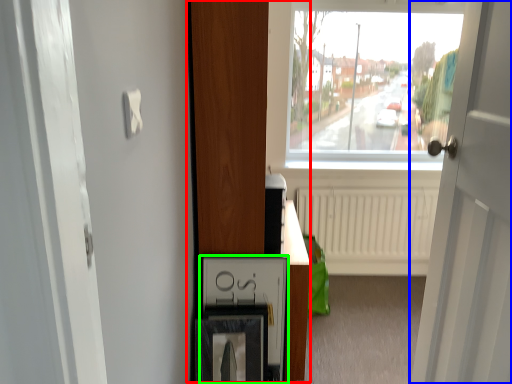
Question: Based on their relative distances, which object is farther from dresser (highlighted by a red box)? Choose from door (highlighted by a blue box) and medicine cabinet (highlighted by a green box).

Choices:
 (A) door
 (B) medicine cabinet

Answer: (A)